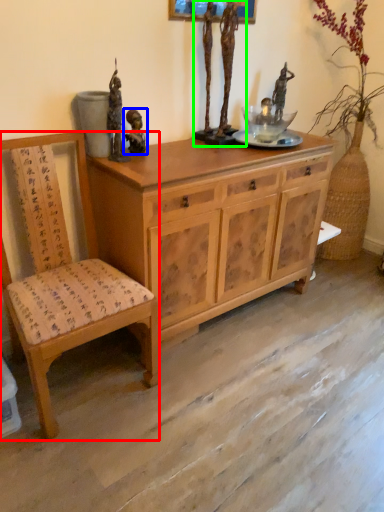
Question: Which object is the closest to the chair (highlighted by a red box)? Choose among these: person (highlighted by a blue box) or sculpture (highlighted by a green box).

Choices:
 (A) person
 (B) sculpture

Answer: (A)